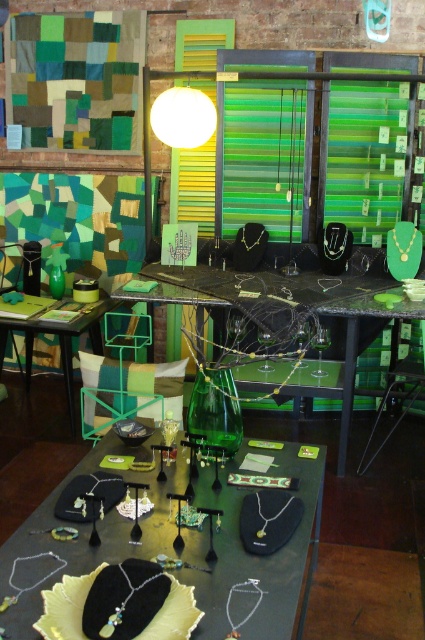
Question: Is shiny silver jewelry at center to the left of white matte lampshade at upper center from the viewer's perspective?

Choices:
 (A) yes
 (B) no

Answer: (B)

Question: Does green glass table at center have a smaller size compared to white matte lampshade at upper center?

Choices:
 (A) no
 (B) yes

Answer: (A)

Question: Among these points, which one is nearest to the camera?

Choices:
 (A) (238, 284)
 (B) (3, 324)
 (C) (175, 109)
 (D) (104, 406)

Answer: (C)

Question: Which point appears closest to the camera in this image?

Choices:
 (A) (204, 116)
 (B) (74, 326)

Answer: (A)

Question: Among these points, which one is farthest from the camera?

Choices:
 (A) (141, 372)
 (B) (207, 102)
 (C) (96, 301)
 (D) (198, 333)

Answer: (C)

Question: Is green fabric pillow at center wider than green glass table at center?

Choices:
 (A) yes
 (B) no

Answer: (B)